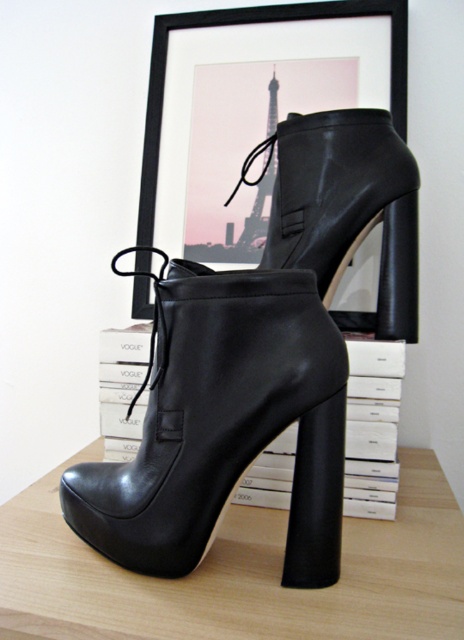
In the scene shown: You are a fashion designer who wants to place a metallic silver eiffel tower at center on top of the black leather platform boot at center. Is the eiffel tower smaller than the boot to fit on it?

The black leather platform boot at center has a larger size compared to metallic silver eiffel tower at center, so yes, the eiffel tower can fit on top of the boot since it is smaller in size.

You are holding a 12 inch ruler and want to measure the distance between yourself and a specific point in the image. The point is located at coordinates point (111, 572). Can your ruler reach that point if you are standing at the viewer position?

The distance between the viewer and point (111, 572) is 23.49 inches. Since your ruler is only 12 inches long, it cannot reach the point.